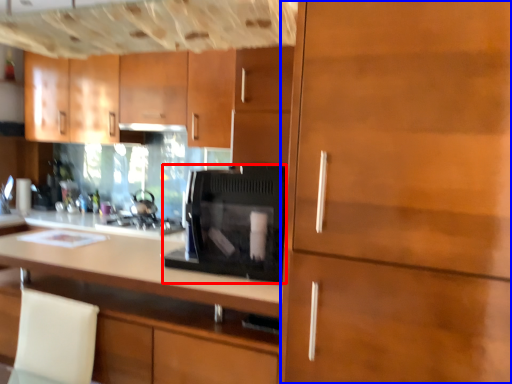
Question: Among these objects, which one is nearest to the camera, home appliance (highlighted by a red box) or cabinetry (highlighted by a blue box)?

Choices:
 (A) home appliance
 (B) cabinetry

Answer: (B)